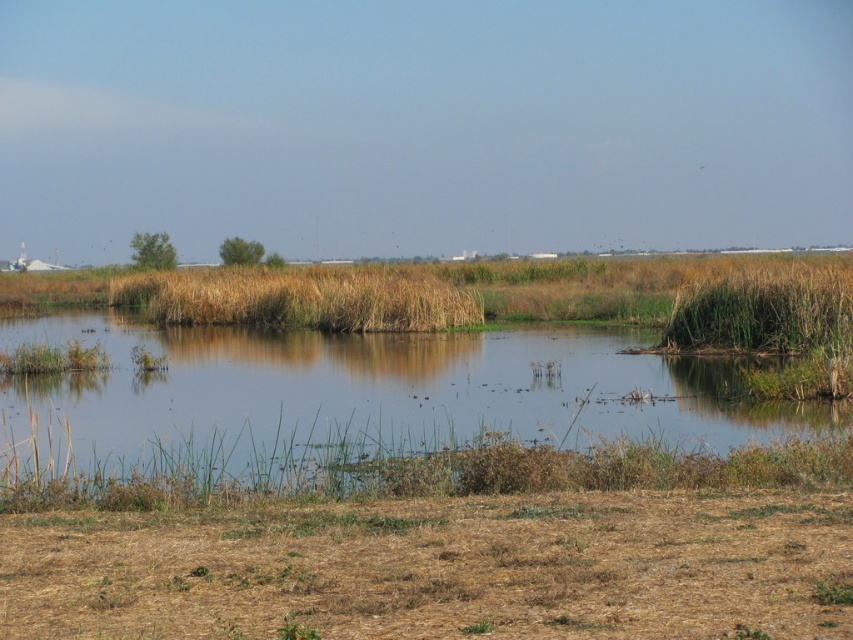
You are a bird flying over the wetland and want to land on the green grassy water at center. Can you see the brown grassy reed at center from your landing spot?

The green grassy water at center is positioned under brown grassy reed at center, so when you land on the green grassy water at center, you can see the brown grassy reed at center above you.

You are a bird flying over the wetland and need to land. You see the green grassy water at center and the brown grassy reed at center. Which area is bigger to land on?

The green grassy water at center is larger in size than the brown grassy reed at center, so the bird should land on the green grassy water at center as it offers a bigger area for landing.